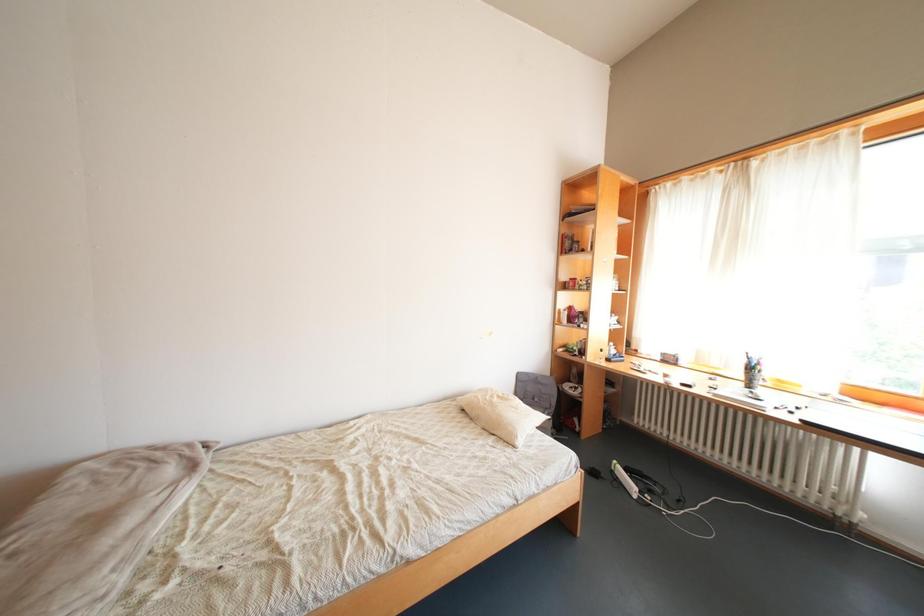
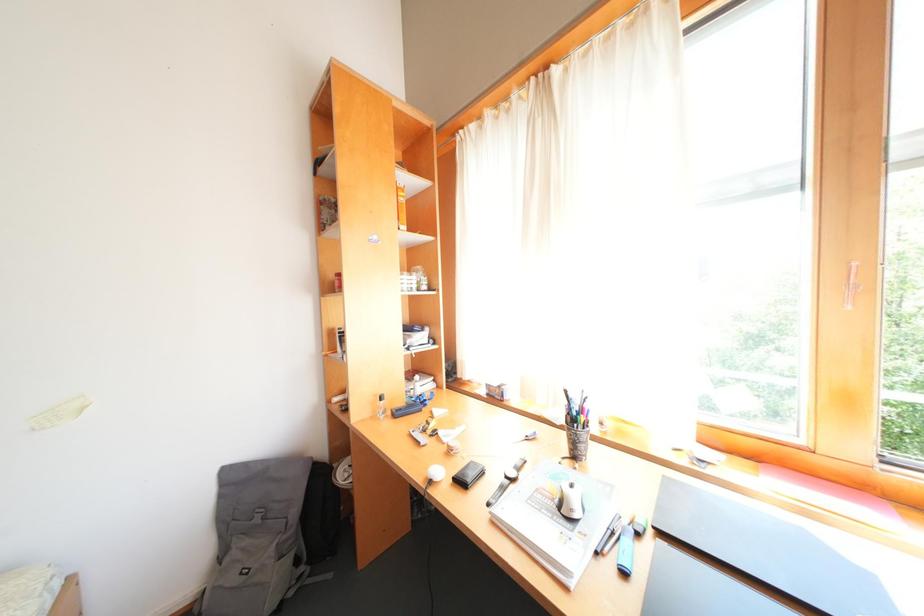
Looking at this image, the images are taken continuously from a first-person perspective. In which direction are you moving?

The cameraman walked toward right, forward.